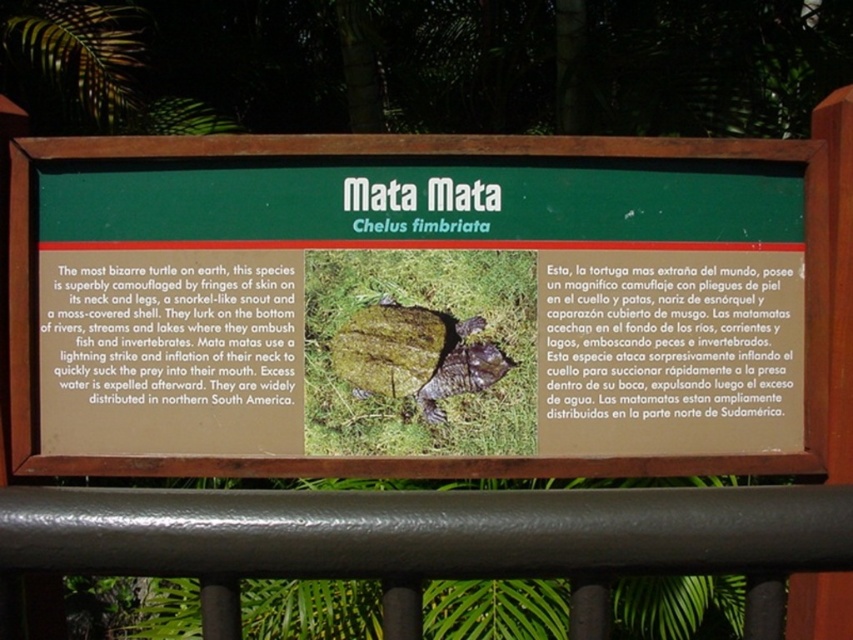
Question: Which point is farther to the camera?

Choices:
 (A) green matte turtle at center
 (B) green moss-covered turtle at center

Answer: (B)

Question: Is green matte turtle at center positioned at the back of green moss-covered turtle at center?

Choices:
 (A) no
 (B) yes

Answer: (A)

Question: Can you confirm if green matte turtle at center is thinner than green moss-covered turtle at center?

Choices:
 (A) yes
 (B) no

Answer: (B)

Question: Is green matte turtle at center to the left of green moss-covered turtle at center from the viewer's perspective?

Choices:
 (A) no
 (B) yes

Answer: (B)